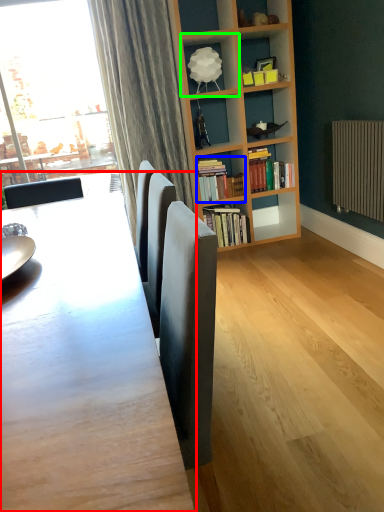
Question: Which object is the farthest from table (highlighted by a red box)? Choose among these: book (highlighted by a blue box) or shelf (highlighted by a green box).

Choices:
 (A) book
 (B) shelf

Answer: (B)